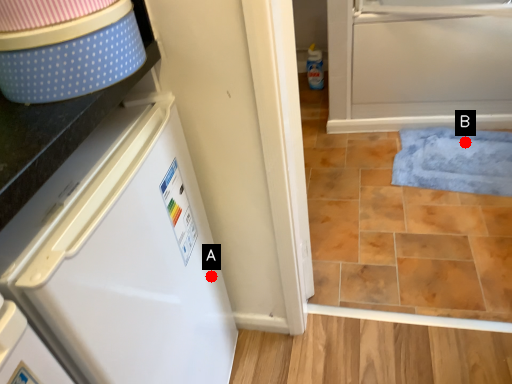
Question: Two points are circled on the image, labeled by A and B beside each circle. Which point appears closest to the camera in this image?

Choices:
 (A) A is closer
 (B) B is closer

Answer: (A)